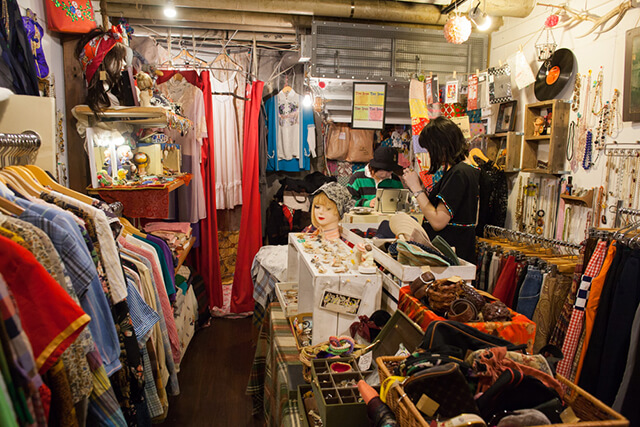
The width and height of the screenshot is (640, 427). I want to click on white wall, so click(x=619, y=49).